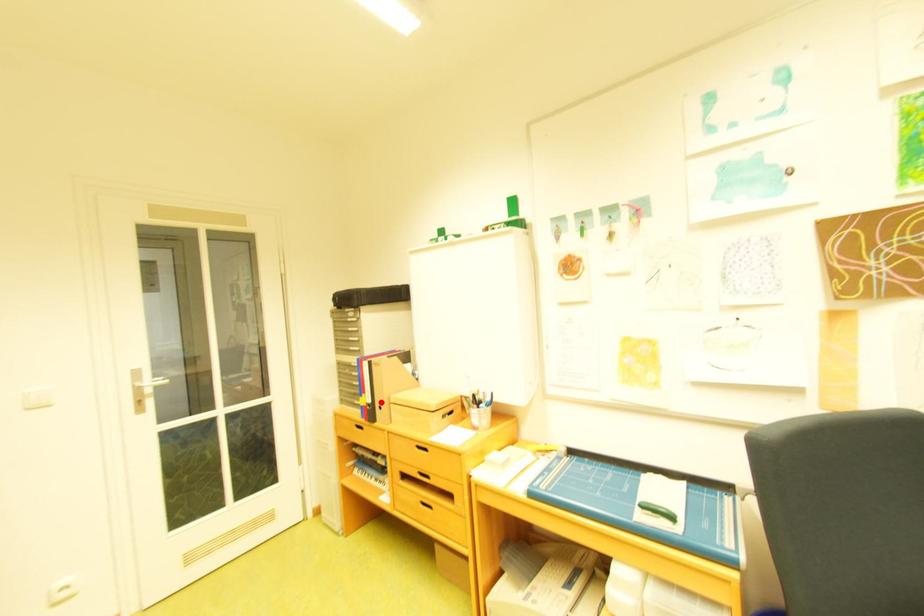
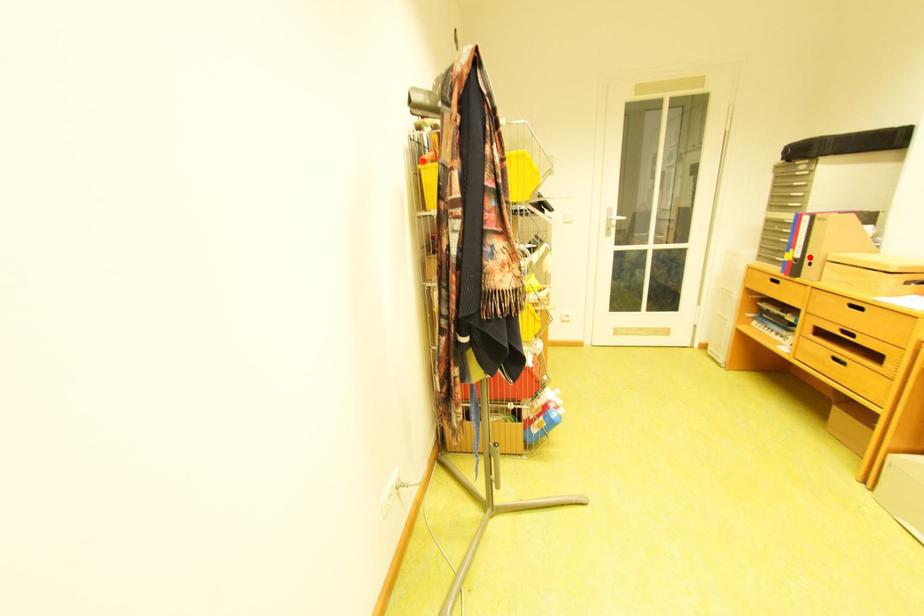
I am providing you with two images of the same scene from different viewpoints. A red point is marked on the first image and another point is marked on the second image. Is the red point in image1 aligned with the point shown in image2?

Yes